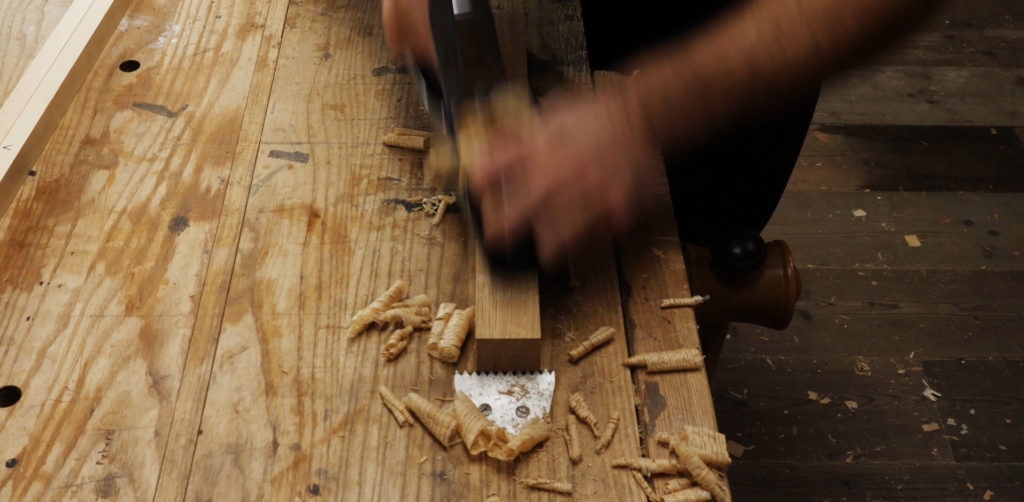
Where is `floor`? floor is located at coordinates click(x=891, y=273), click(x=901, y=85).